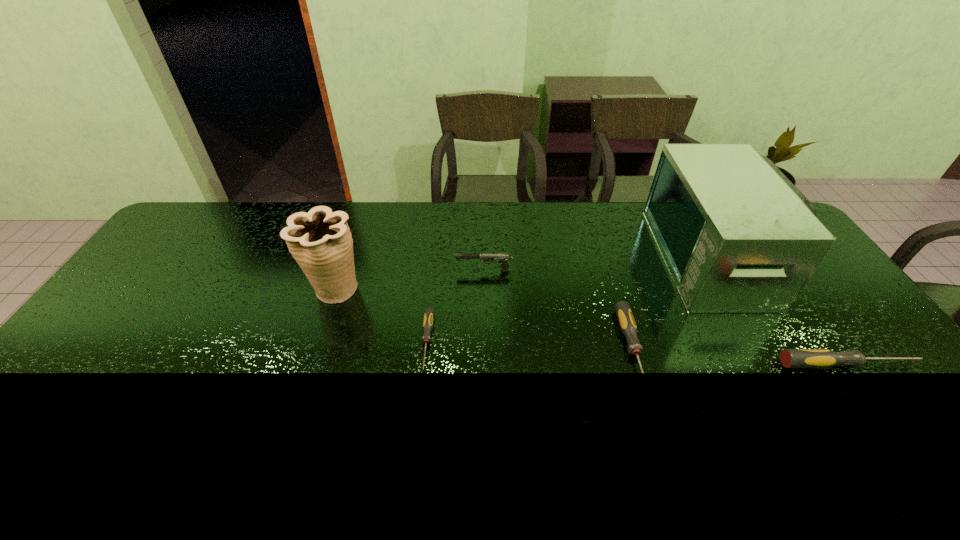
The width and height of the screenshot is (960, 540). In order to click on microwave oven situated at the right edge in this screenshot , I will do `click(737, 236)`.

Identify the location of object that is at the far right corner. The height and width of the screenshot is (540, 960). (737, 236).

The width and height of the screenshot is (960, 540). Find the location of `free space at the far edge`. free space at the far edge is located at coordinates (274, 227).

This screenshot has height=540, width=960. I want to click on vacant space at the near edge, so click(716, 390).

I want to click on vacant space at the left edge of the desktop, so click(x=167, y=266).

Find the location of a particular element. The width and height of the screenshot is (960, 540). vacant region between the leftmost object and the second screwdriver from left to right is located at coordinates (485, 321).

Where is `free space between the microwave oven and the shortest object`? This screenshot has width=960, height=540. free space between the microwave oven and the shortest object is located at coordinates (572, 299).

Where is `vacant region between the gun and the leftmost screwdriver`? vacant region between the gun and the leftmost screwdriver is located at coordinates point(456,306).

Find the location of a particular element. The height and width of the screenshot is (540, 960). free spot between the leftmost screwdriver and the third object from left to right is located at coordinates (456, 306).

Find the location of a particular element. The image size is (960, 540). free spot between the third object from right to left and the third tallest object is located at coordinates (559, 312).